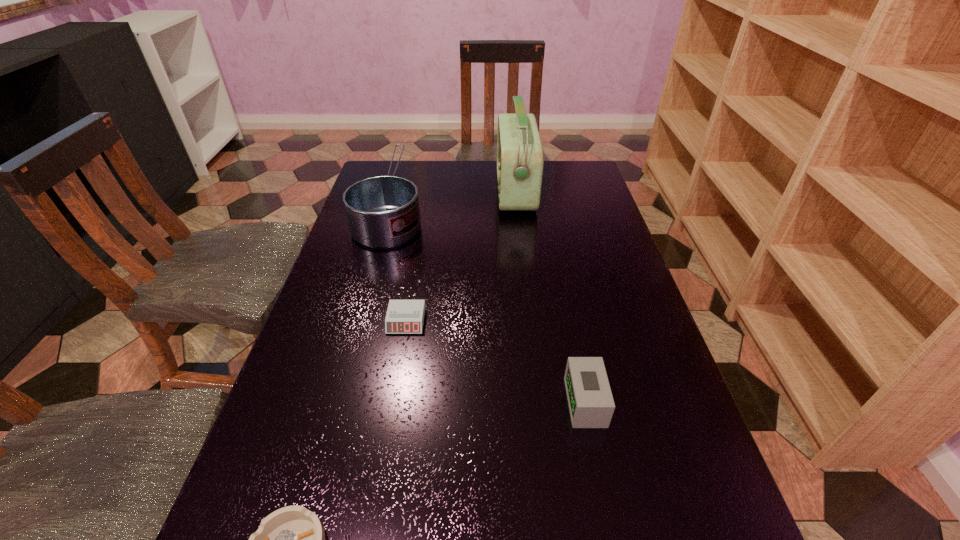
Locate an element on the screen. The height and width of the screenshot is (540, 960). vacant area that lies between the left alarm clock and the saucepan is located at coordinates (399, 262).

Identify which object is the nearest to the second nearest object. Please provide its 2D coordinates. Your answer should be formatted as a tuple, i.e. [(x, y)], where the tuple contains the x and y coordinates of a point satisfying the conditions above.

[(403, 316)]

Locate which object is the fourth closest to the farther alarm clock. Please provide its 2D coordinates. Your answer should be formatted as a tuple, i.e. [(x, y)], where the tuple contains the x and y coordinates of a point satisfying the conditions above.

[(520, 157)]

Where is `vacant region that satisfies the following two spatial constraints: 1. on the front panel of the tallest object; 2. on the front side of the shorter alarm clock`? vacant region that satisfies the following two spatial constraints: 1. on the front panel of the tallest object; 2. on the front side of the shorter alarm clock is located at coordinates (530, 321).